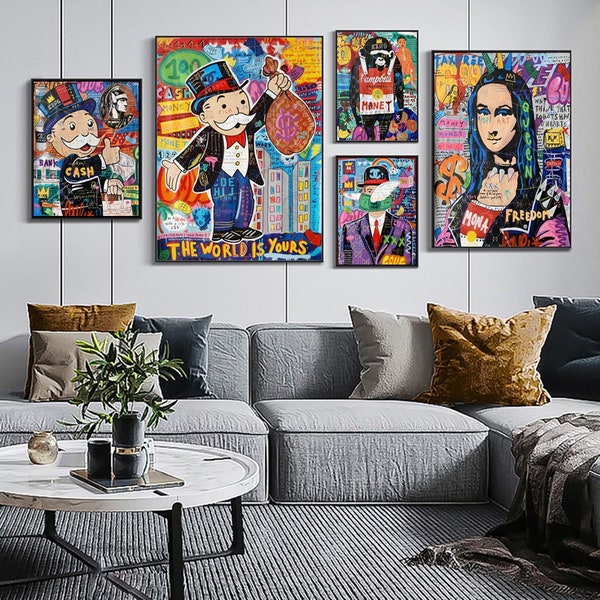
The height and width of the screenshot is (600, 600). Identify the location of couch. (302, 368).